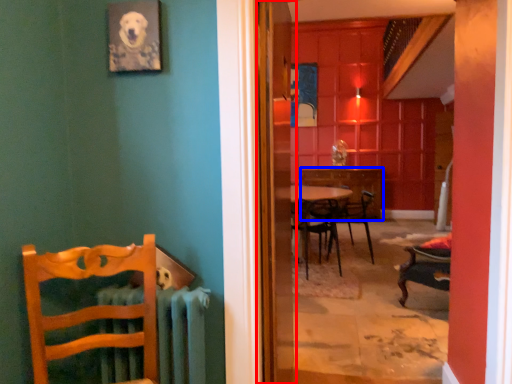
Question: Which of the following is the farthest to the observer, screen door (highlighted by a red box) or desk (highlighted by a blue box)?

Choices:
 (A) screen door
 (B) desk

Answer: (B)